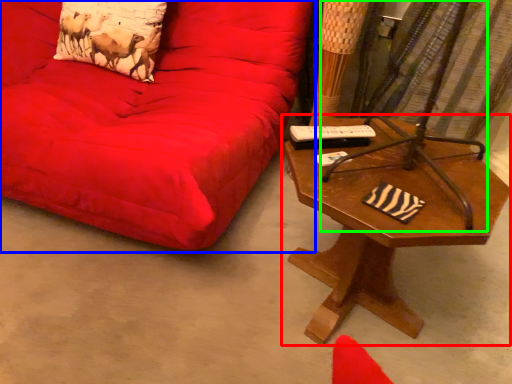
Question: Based on their relative distances, which object is farther from table (highlighted by a red box)? Choose from studio couch (highlighted by a blue box) and swivel chair (highlighted by a green box).

Choices:
 (A) studio couch
 (B) swivel chair

Answer: (A)